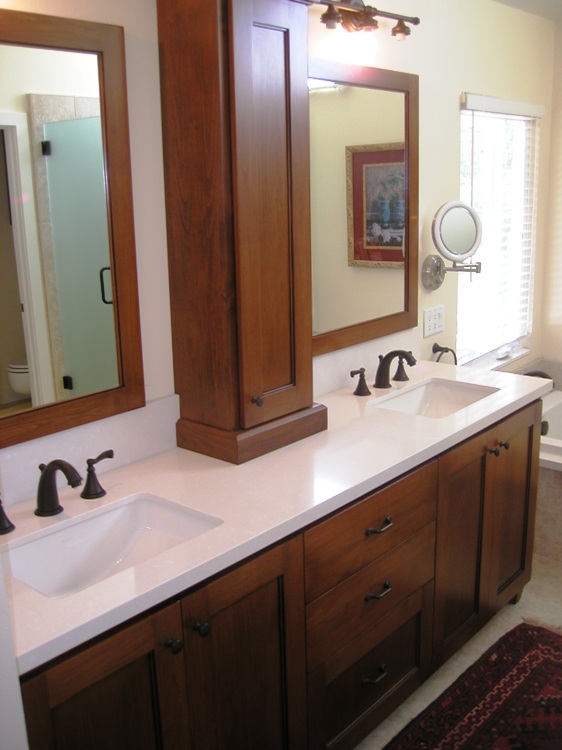
Where is `reflection of framed artwork`? The width and height of the screenshot is (562, 750). reflection of framed artwork is located at coordinates (384, 193).